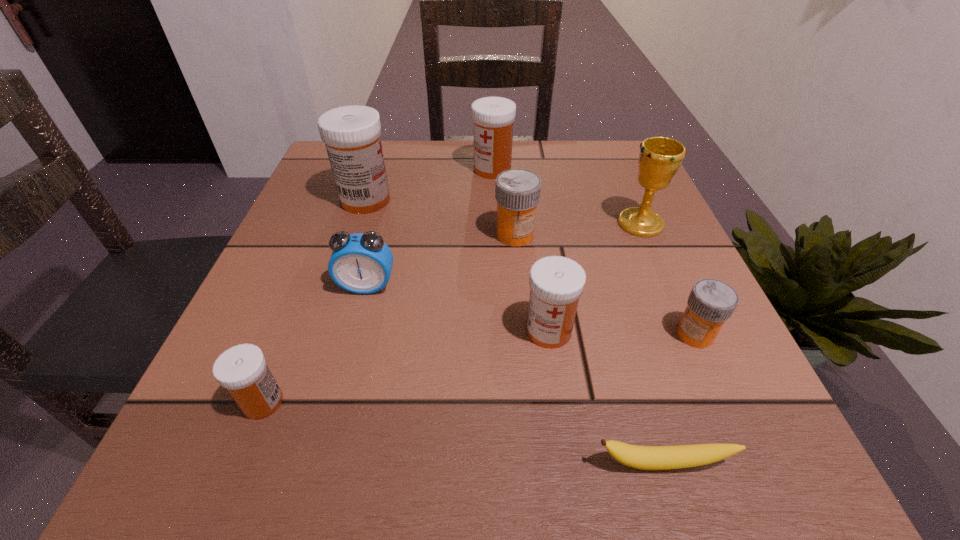
The image size is (960, 540). In order to click on free space between the nearest white medicine and the fourth nearest medicine in this screenshot , I will do `click(389, 319)`.

The height and width of the screenshot is (540, 960). Identify the location of unoccupied position between the nearer orange medicine and the second biggest white medicine. (593, 252).

This screenshot has width=960, height=540. Identify the location of vacant space that's between the eighth farthest object and the fifth farthest object. (315, 344).

Locate an element on the screen. Image resolution: width=960 pixels, height=540 pixels. free space between the gold chalice and the alarm clock is located at coordinates (504, 255).

Identify the location of blank region between the fifth nearest object and the farthest white medicine. The width and height of the screenshot is (960, 540). (429, 227).

Locate an element on the screen. Image resolution: width=960 pixels, height=540 pixels. blank region between the third biggest white medicine and the nearest medicine is located at coordinates (406, 367).

Identify the location of empty space that is in between the third farthest white medicine and the second farthest medicine. The image size is (960, 540). (457, 265).

I want to click on object that can be found as the eighth closest to the farther orange medicine, so click(242, 370).

In order to click on the eighth closest object to the chalice in this screenshot , I will do `click(242, 370)`.

Select which medicine is the fifth closest to the gold chalice. Please provide its 2D coordinates. Your answer should be formatted as a tuple, i.e. [(x, y)], where the tuple contains the x and y coordinates of a point satisfying the conditions above.

[(351, 133)]